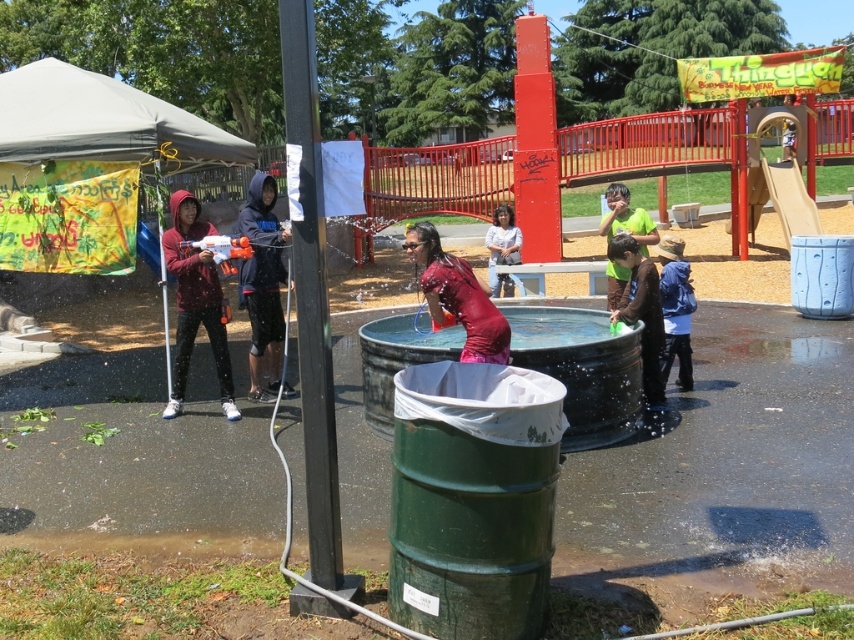
You are at the community event and want to take a photo of both the shiny red dress at center and the green matte shirt at center. Which one should you focus on first to ensure both are in the frame?

You should focus on the shiny red dress at center first since it is in front of the green matte shirt at center, ensuring both are visible in the frame.

Based on the photo, you are organizing a community event and need to place a sign near the blue fleece jacket at lower right and the green matte shirt at center. Which object should the sign be placed closer to if you want it to be between them?

The sign should be placed closer to the blue fleece jacket at lower right because it is positioned on the right side of the green matte shirt at center, so placing it between them would require positioning it near the right side of the green matte shirt at center, closer to the blue fleece jacket at lower right.

You are organizing a clothing drive and need to pack these two items into a box. The box can only fit items that are narrower than 30 cm. You know the green matte shirt at center is 35 cm wide. Can the dark blue hoodie at center fit into the box?

The dark blue hoodie at center has a lesser width compared to the green matte shirt at center, which is 35 cm wide. Therefore, the dark blue hoodie at center is narrower than 35 cm and can fit into the box.